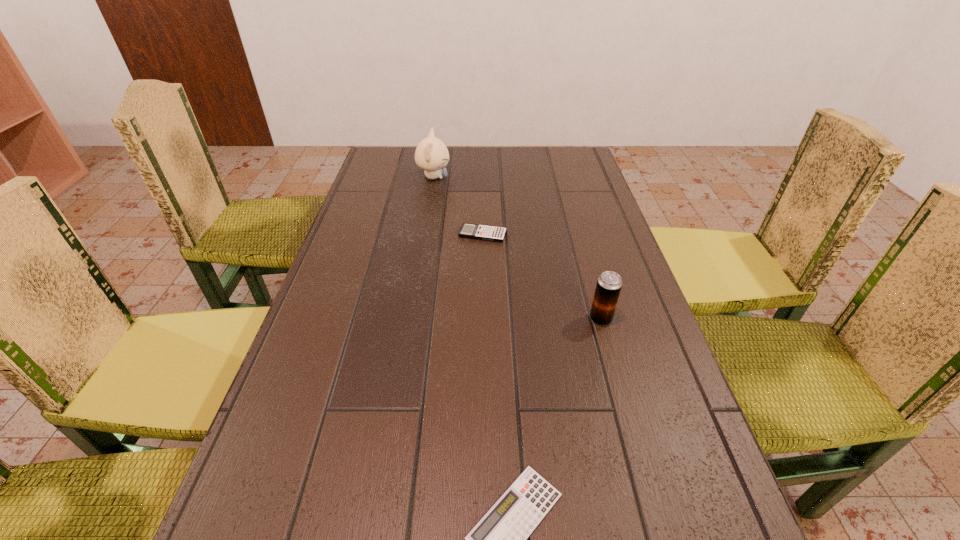
Image resolution: width=960 pixels, height=540 pixels. I want to click on vacant space that satisfies the following two spatial constraints: 1. on the face of the tallest object; 2. on the back side of the second nearest object, so click(411, 319).

Where is `vacant space that satisfies the following two spatial constraints: 1. on the back side of the second tallest object; 2. on the face of the farthest object`? This screenshot has height=540, width=960. vacant space that satisfies the following two spatial constraints: 1. on the back side of the second tallest object; 2. on the face of the farthest object is located at coordinates (561, 177).